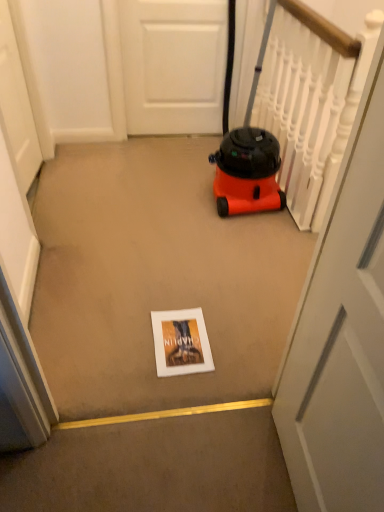
Question: Looking at the image, does white glossy door at center, which is counted as the third door, starting from the left, seem bigger or smaller compared to orange matte vacuum cleaner at center-right?

Choices:
 (A) small
 (B) big

Answer: (A)

Question: From a real-world perspective, is white glossy door at center, arranged as the 1th door when viewed from the right, positioned above or below orange matte vacuum cleaner at center-right?

Choices:
 (A) below
 (B) above

Answer: (B)

Question: Which object is the farthest from the matte white book at center?

Choices:
 (A) white matte door at left, the first door from the left
 (B) orange matte vacuum cleaner at center-right
 (C) white matte door at upper center, marked as the 2th door in a right-to-left arrangement
 (D) white glossy door at center, which is counted as the third door, starting from the left

Answer: (C)

Question: Which of these objects is positioned farthest from the matte white book at center?

Choices:
 (A) orange matte vacuum cleaner at center-right
 (B) white matte door at upper center, the 3th door viewed from the front
 (C) white matte door at left, the first door from the left
 (D) white glossy door at center, which is counted as the third door, starting from the left

Answer: (B)